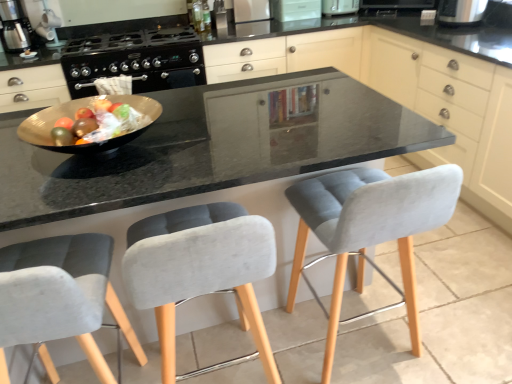
Question: Is shiny gold bowl at center taller or shorter than white glossy microwave at upper center, placed as the 3th appliance when sorted from left to right?

Choices:
 (A) tall
 (B) short

Answer: (B)

Question: Does point 97,147 appear closer or farther from the camera than point 314,16?

Choices:
 (A) closer
 (B) farther

Answer: (A)

Question: Considering the real-world distances, which object is farthest from the velvet grey chair at center, placed as the 1th chair when sorted from right to left?

Choices:
 (A) white plastic toaster at upper center, placed as the 2th appliance when sorted from right to left
 (B) velvet grey chair at lower left, which is the 1th chair in left-to-right order
 (C) matte gray cabinet at center, arranged as the 2th cabinetry when viewed from the right
 (D) shiny gold bowl at center
 (E) metallic silver toaster at upper center, which is the 5th appliance from right to left

Answer: (A)

Question: Based on their relative distances, which object is farther from the matte gray cabinet at center, arranged as the 2th cabinetry when viewed from the right?

Choices:
 (A) black plastic toaster at upper right, the first appliance when ordered from right to left
 (B) shiny gold bowl at center
 (C) velvet grey chair at center, which is the 3th chair in left-to-right order
 (D) velvet grey chair at center, which is counted as the 2th chair, starting from the left
 (E) metallic silver toaster at upper center, which is the first appliance from left to right

Answer: (D)